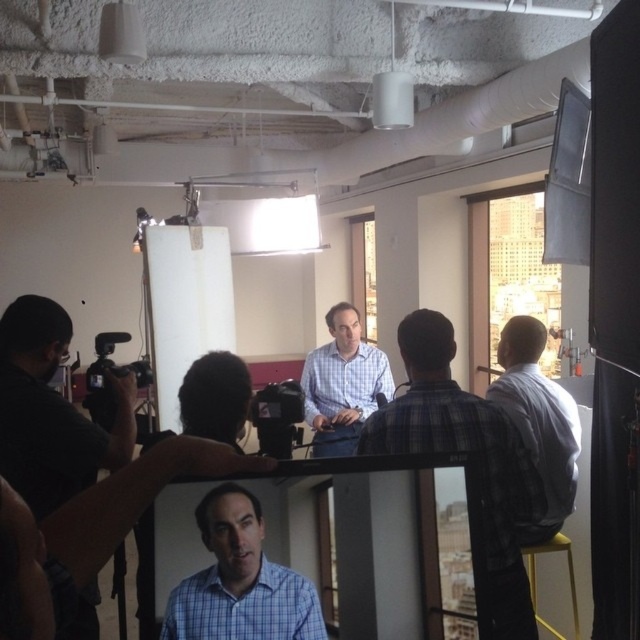
Question: Which object is closer to the camera taking this photo?

Choices:
 (A) matte black camera at left
 (B) checkered shirt at center

Answer: (A)

Question: Can you confirm if matte black camera at left is positioned to the left of black plastic video camera at left?

Choices:
 (A) yes
 (B) no

Answer: (B)

Question: Which point is closer to the camera?

Choices:
 (A) (528, 611)
 (B) (282, 566)
 (C) (545, 625)
 (D) (88, 588)

Answer: (B)

Question: Does matte black camera at left have a greater width compared to checkered shirt at center?

Choices:
 (A) yes
 (B) no

Answer: (B)

Question: Based on their relative distances, which object is nearer to the matte black camera at left?

Choices:
 (A) white shirt at right
 (B) blue checkered shirt at center

Answer: (B)

Question: In this image, where is blue checkered shirt at center located relative to checkered shirt at center?

Choices:
 (A) right
 (B) left

Answer: (B)